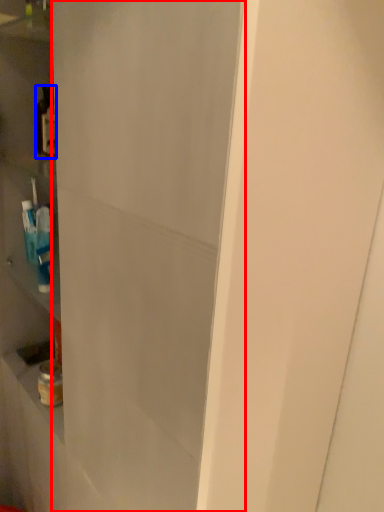
Question: Which object appears farthest to the camera in this image, glass door (highlighted by a red box) or bottle (highlighted by a blue box)?

Choices:
 (A) glass door
 (B) bottle

Answer: (B)